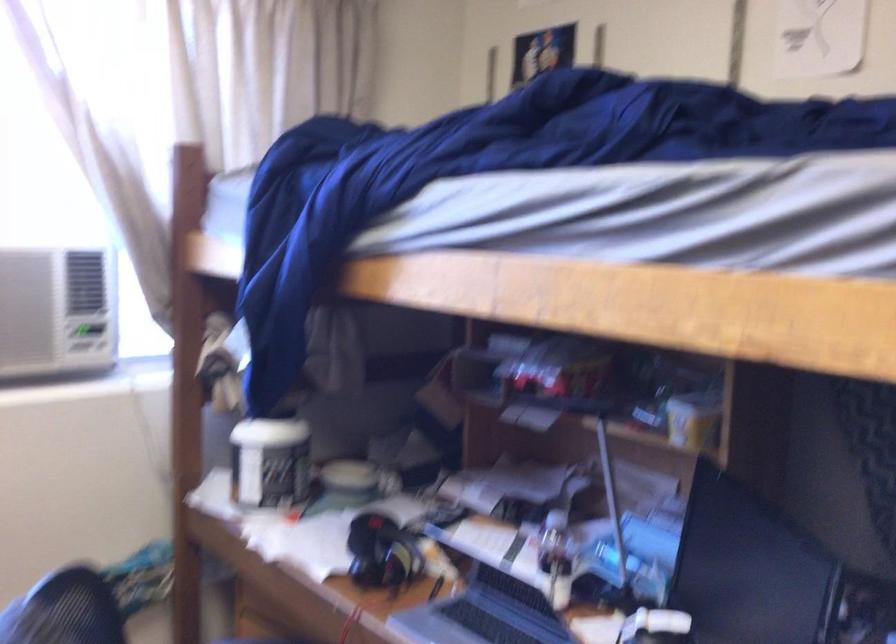
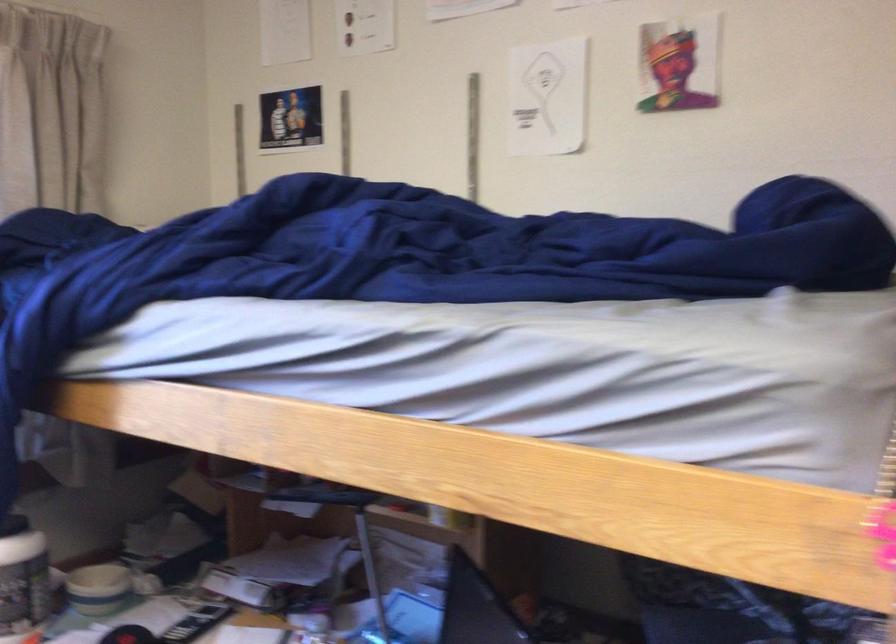
Question: How did the camera likely rotate?

Choices:
 (A) Left
 (B) Right
 (C) Up
 (D) Down

Answer: (B)